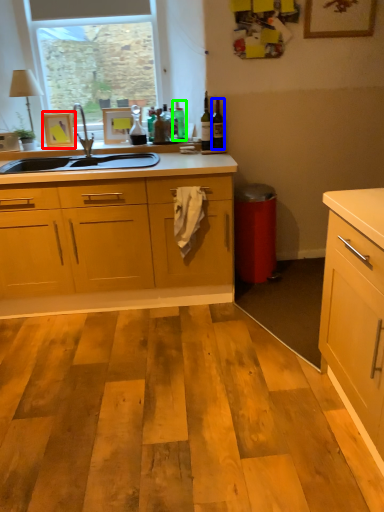
Question: Estimate the real-world distances between objects in this image. Which object is closer to picture frame (highlighted by a red box), bottle (highlighted by a blue box) or bottle (highlighted by a green box)?

Choices:
 (A) bottle
 (B) bottle

Answer: (B)